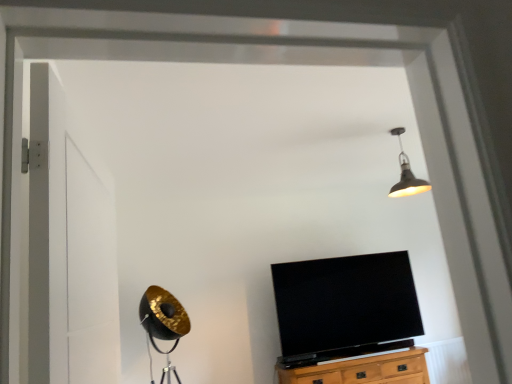
Question: Looking at the image, does black glossy tv at center seem bigger or smaller compared to wooden cabinet at lower center?

Choices:
 (A) big
 (B) small

Answer: (A)

Question: Considering the relative positions of black glossy tv at center and wooden cabinet at lower center in the image provided, is black glossy tv at center to the left or to the right of wooden cabinet at lower center?

Choices:
 (A) right
 (B) left

Answer: (B)

Question: Considering the real-world distances, which object is farthest from the metallic pendant light at upper center?

Choices:
 (A) wooden cabinet at lower center
 (B) white matte door at left
 (C) black glossy tv at center

Answer: (B)

Question: Which is nearer to the black glossy tv at center?

Choices:
 (A) white matte door at left
 (B) wooden cabinet at lower center
 (C) metallic pendant light at upper center

Answer: (B)